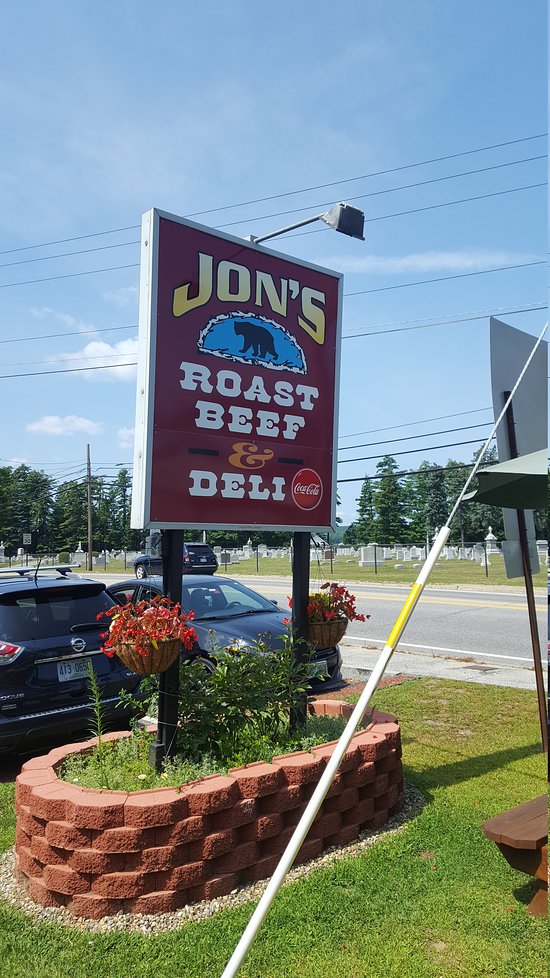
The width and height of the screenshot is (550, 978). Identify the location of planter. (210, 788).